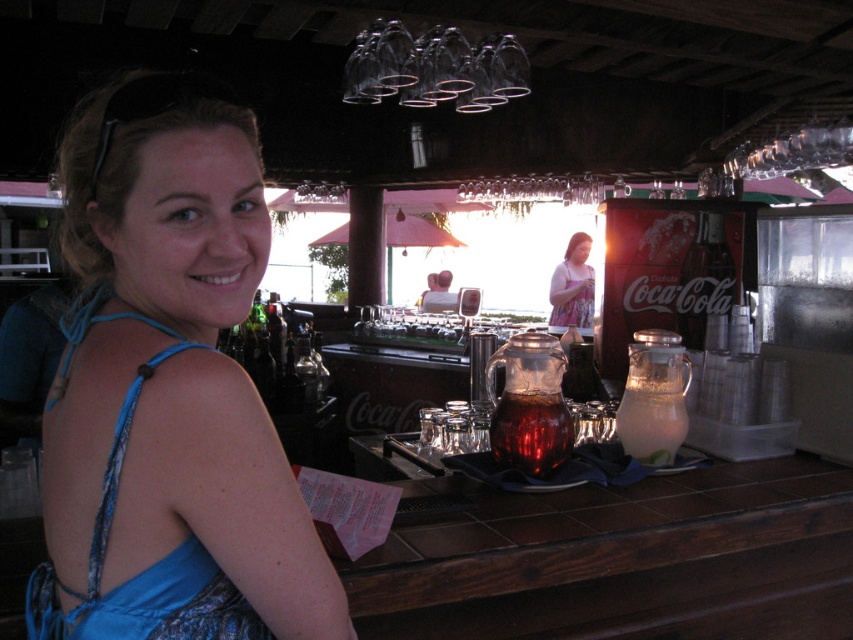
You are a bartender preparing drinks for a party. You need to place a large decorative centerpiece on the bar counter. The blue fabric dress at left and the translucent glass pitcher at center are currently occupying space. Which item should you move to make room for the centerpiece?

The blue fabric dress at left is larger in size than the translucent glass pitcher at center, so you should move the blue fabric dress at left to make room for the centerpiece.

You are a bartender at the bar and need to reach the translucent glass pitcher at center to refill drinks. There is a blue fabric dress at left in your way. Can you easily access the pitcher without moving the dress?

The blue fabric dress at left is positioned over the translucent glass pitcher at center, meaning the dress is covering the pitcher. Therefore, you cannot easily access the pitcher without moving the dress.

You are a bartender at the bar. You need to reach for the clear glass pitcher at center and the pink floral dress at center. Which one is closer to you?

The clear glass pitcher at center is closer to you because it is positioned under the pink floral dress at center, which is further away.